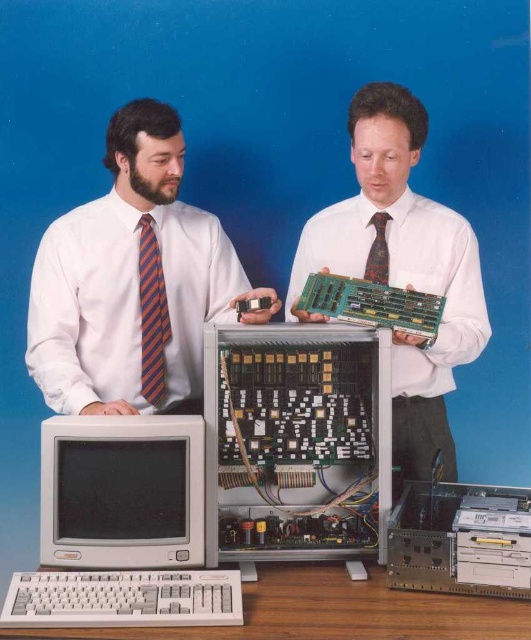
You are a photographer setting up a shoot in this scene. You need to place a 12cm wide decorative item between the matte gray monitor at lower left and the multicolored woven tie at upper right. Based on their widths, will the space between them be sufficient to fit the item without overlapping either object?

The matte gray monitor at lower left has a larger width than the multicolored woven tie at upper right. Since the decorative item is 12cm wide, the space between them may be sufficient as long as the total available space between the two objects is at least 12cm. However, without exact measurements of the distance between them, it is difficult to confirm definitively.

Please describe the location of the matte gray monitor at lower left in terms of coordinates. The coordinate system is defined as follows. The origin is at the bottom left corner of the image. The x and y axes are normalized between 0 and 1. The x axis increases to the right, and the y axis increases upward.

The matte gray monitor at lower left is located at coordinates point (122, 492).

You are a photographer setting up for a professional headshot. You need to ensure that both the matte gray monitor at lower left and the multicolored woven tie at upper right are visible in the frame. Which object should you focus on first to ensure both are in focus?

The matte gray monitor at lower left is closer to the viewer than the multicolored woven tie at upper right. To ensure both are in focus, focus on the matte gray monitor at lower left first, as it is the closer object, and adjust the depth of field to include the multicolored woven tie at upper right in the background.